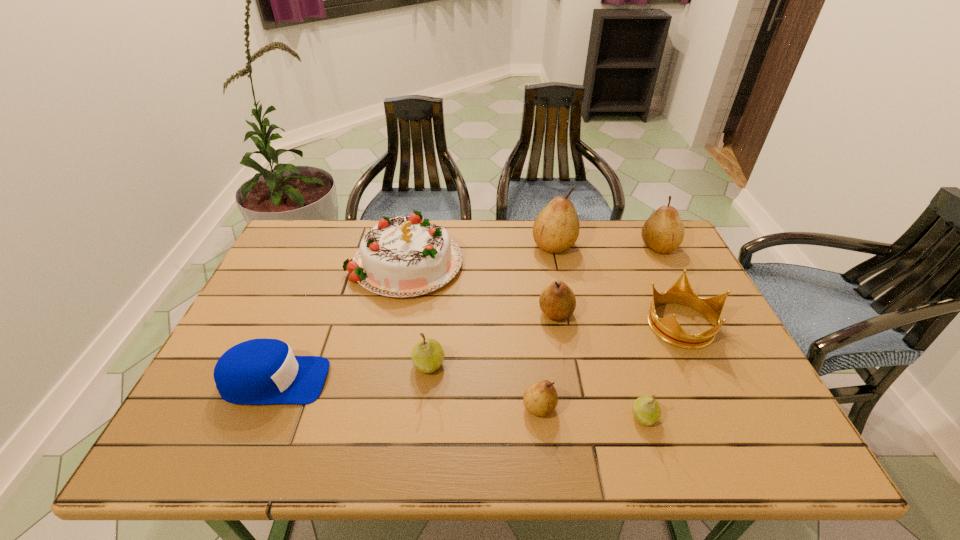
You are a GUI agent. You are given a task and a screenshot of the screen. Output one action in this format:
    pyautogui.click(x=<x>, y=<y>)
    Task: Click on the vacant point located between the third nearest pear and the baseball cap
    Image resolution: width=960 pixels, height=540 pixels.
    Given the screenshot: What is the action you would take?
    (351, 373)

In order to click on vacant space that is in between the biggest brown pear and the blue baseball cap in this screenshot , I will do pyautogui.click(x=414, y=313).

Identify the location of object that is the second closest one to the blue baseball cap. This screenshot has height=540, width=960. (427, 355).

Identify which object is the closest to the gold crown. Please provide its 2D coordinates. Your answer should be formatted as a tuple, i.e. [(x, y)], where the tuple contains the x and y coordinates of a point satisfying the conditions above.

[(647, 411)]

Where is `pear identified as the closest to the third biggest brown pear`? pear identified as the closest to the third biggest brown pear is located at coordinates (556, 228).

Locate an element on the screen. pear that is the third nearest to the crown is located at coordinates (557, 301).

Identify the location of the closest brown pear to the rightmost brown pear. (556, 228).

The image size is (960, 540). Identify the location of brown pear that can be found as the second closest to the cake. (556, 228).

The image size is (960, 540). I want to click on vacant point that satisfies the following two spatial constraints: 1. on the front side of the cake; 2. on the right side of the nearest brown pear, so click(376, 407).